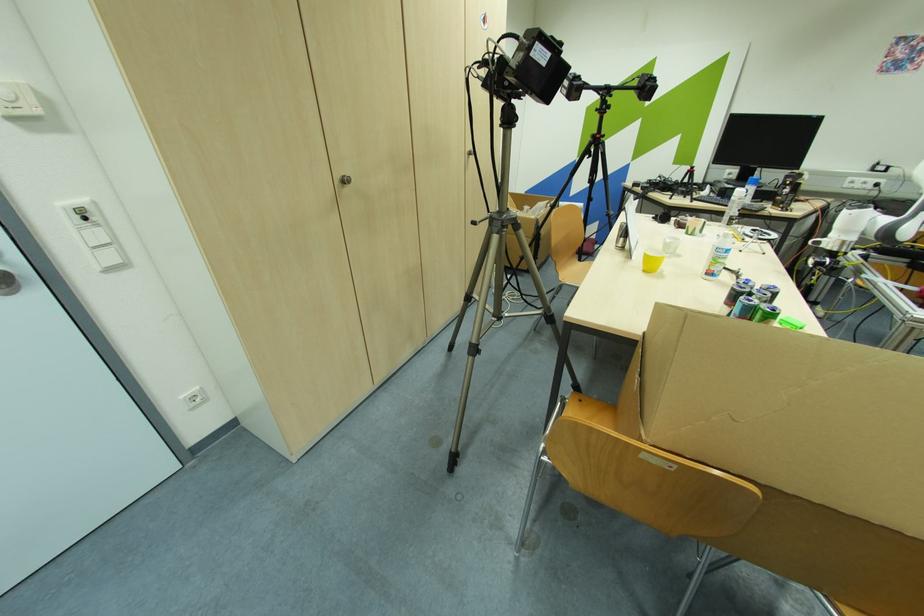
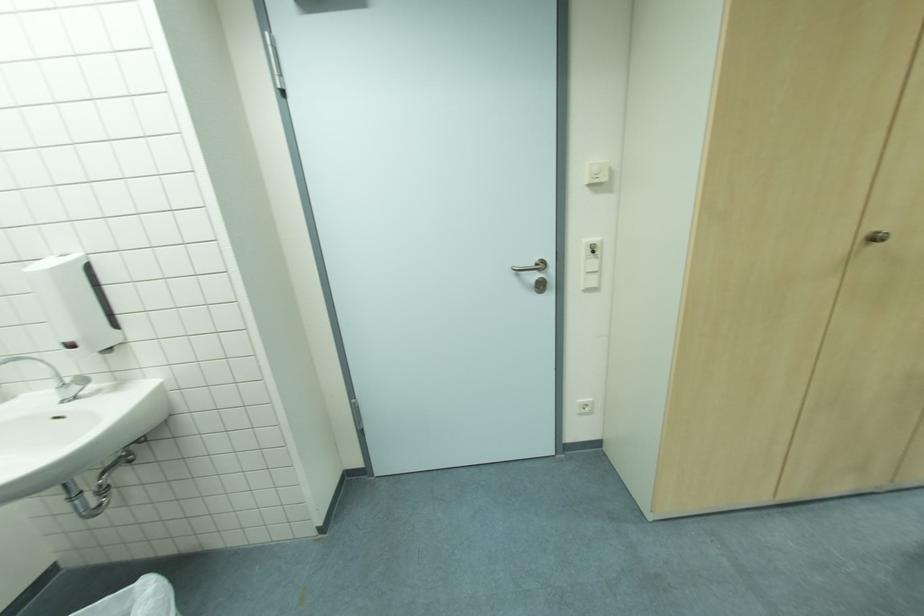
Find the pixel in the second image that matches the point at 41,111 in the first image.

(608, 179)